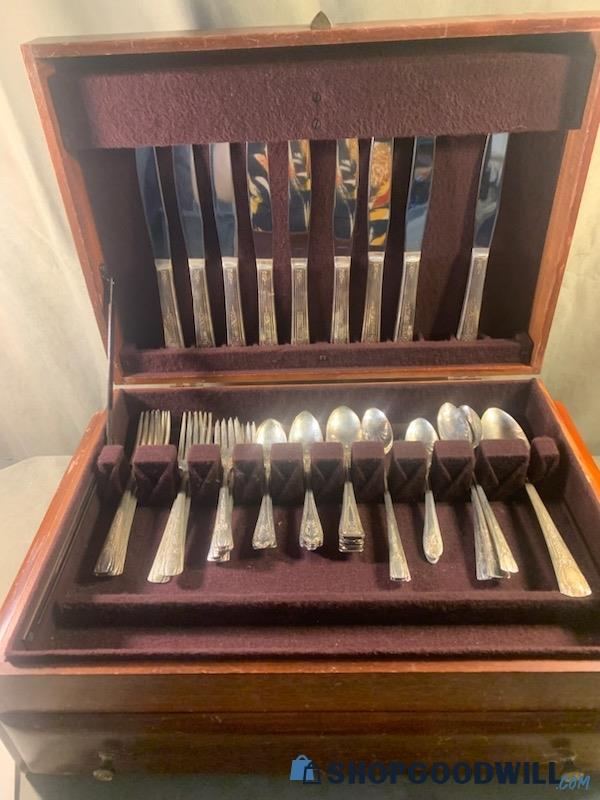
What are the coordinates of `spoons` in the screenshot? It's located at (272, 434), (306, 430), (337, 430), (376, 430), (419, 434), (444, 428), (472, 418), (498, 425).